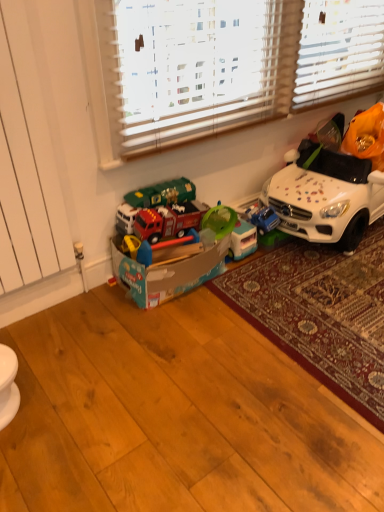
Question: From the image's perspective, relative to green plastic cup at center, arranged as the 2th toy when viewed from the left, is white matte toy car at right above or below?

Choices:
 (A) below
 (B) above

Answer: (B)

Question: From a real-world perspective, relative to green plastic cup at center, arranged as the 2th toy when viewed from the left, is white matte toy car at right vertically above or below?

Choices:
 (A) above
 (B) below

Answer: (A)

Question: Estimate the real-world distances between objects in this image. Which object is closer to the red plastic toy truck at center, marked as the 3th toy in a right-to-left arrangement?

Choices:
 (A) green plastic cup at center, arranged as the 2th toy when viewed from the left
 (B) white matte toy car at right
 (C) white textured blinds at upper center
 (D) blue plastic toy car at center, positioned as the 1th toy in right-to-left order
 (E) carpeted rug at lower right

Answer: (A)

Question: Estimate the real-world distances between objects in this image. Which object is closer to the carpeted rug at lower right?

Choices:
 (A) white textured blinds at upper center
 (B) white matte toy car at right
 (C) green plastic cup at center, the second toy from the right
 (D) red plastic toy truck at center, marked as the 3th toy in a right-to-left arrangement
 (E) blue plastic toy car at center, arranged as the third toy when viewed from the left

Answer: (D)